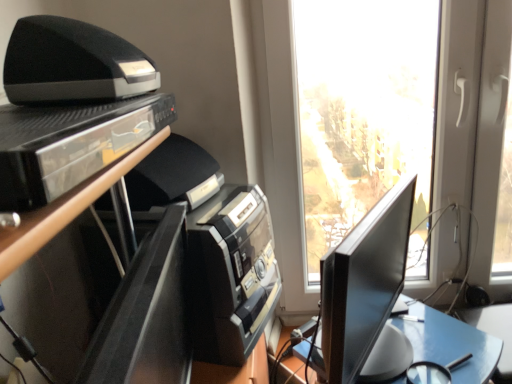
Question: From the image's perspective, is black glossy monitor at right on top of black glossy shelf at upper left?

Choices:
 (A) no
 (B) yes

Answer: (A)

Question: Is black glossy monitor at right far away from black glossy shelf at upper left?

Choices:
 (A) yes
 (B) no

Answer: (B)

Question: Considering the relative sizes of black glossy monitor at right and black glossy shelf at upper left in the image provided, is black glossy monitor at right taller than black glossy shelf at upper left?

Choices:
 (A) no
 (B) yes

Answer: (B)

Question: Considering the relative sizes of black glossy monitor at right and black glossy shelf at upper left in the image provided, is black glossy monitor at right smaller than black glossy shelf at upper left?

Choices:
 (A) yes
 (B) no

Answer: (B)

Question: From the image's perspective, is black glossy monitor at right beneath black glossy shelf at upper left?

Choices:
 (A) yes
 (B) no

Answer: (A)

Question: Considering their positions, is black plastic printer at upper left located in front of or behind black glossy entertainment center at left?

Choices:
 (A) front
 (B) behind

Answer: (A)

Question: Is black plastic printer at upper left bigger or smaller than black glossy entertainment center at left?

Choices:
 (A) big
 (B) small

Answer: (B)

Question: From a real-world perspective, is black plastic printer at upper left positioned above or below black glossy entertainment center at left?

Choices:
 (A) above
 (B) below

Answer: (A)

Question: Is black plastic printer at upper left taller or shorter than black glossy entertainment center at left?

Choices:
 (A) tall
 (B) short

Answer: (B)

Question: Is black glossy shelf at upper left situated inside black glossy monitor at right or outside?

Choices:
 (A) inside
 (B) outside

Answer: (B)

Question: In terms of height, does black glossy shelf at upper left look taller or shorter compared to black glossy monitor at right?

Choices:
 (A) short
 (B) tall

Answer: (A)

Question: Is black glossy shelf at upper left wider or thinner than black glossy monitor at right?

Choices:
 (A) thin
 (B) wide

Answer: (B)

Question: Considering the positions of black glossy shelf at upper left and black glossy monitor at right in the image, is black glossy shelf at upper left bigger or smaller than black glossy monitor at right?

Choices:
 (A) big
 (B) small

Answer: (B)

Question: Is black glossy monitor at right inside or outside of black plastic printer at upper left?

Choices:
 (A) inside
 (B) outside

Answer: (B)

Question: From their relative heights in the image, would you say black glossy monitor at right is taller or shorter than black plastic printer at upper left?

Choices:
 (A) short
 (B) tall

Answer: (B)